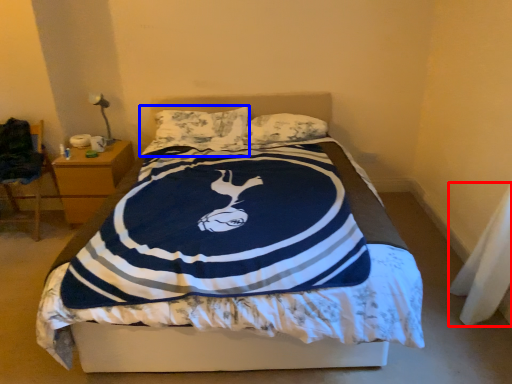
Question: Among these objects, which one is nearest to the camera, material (highlighted by a red box) or pillow (highlighted by a blue box)?

Choices:
 (A) material
 (B) pillow

Answer: (A)